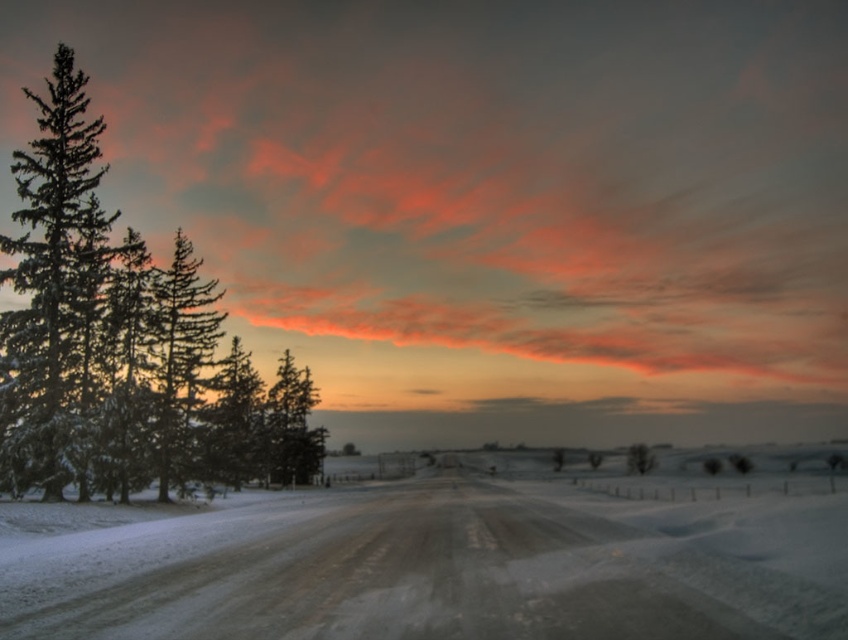
You are standing at the point closer to the viewer in the image. There are two points marked in the scene, one at point coordinates point (799, 636) and another at point coordinates point (49, 125). Which point is farther away from your current position?

Point (49, 125) is farther away from your current position because you are standing at the point closer to the viewer, which is point (799, 636). Since point (49, 125) is farther from the viewer, it is also farther from your current position.